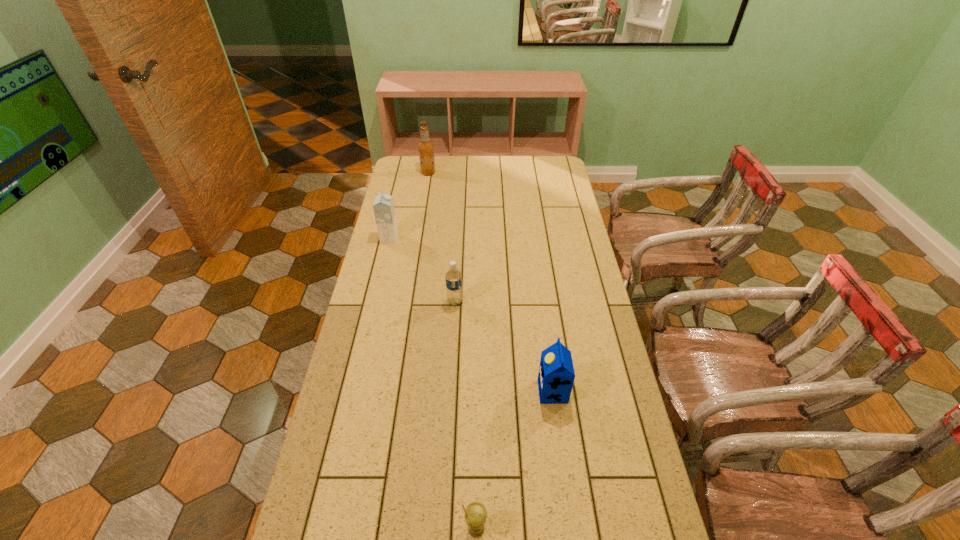
The width and height of the screenshot is (960, 540). In order to click on free spot that satisfies the following two spatial constraints: 1. on the front label of the leftmost object; 2. on the right side of the water bottle in this screenshot , I will do `click(374, 302)`.